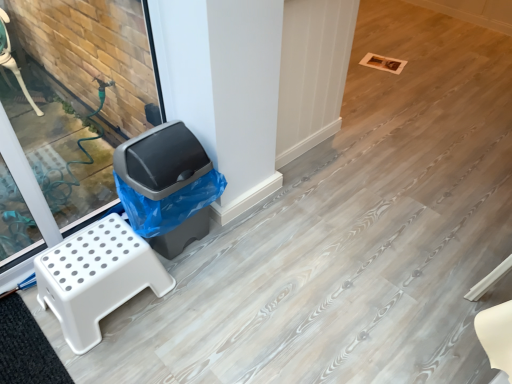
Where is `empty space that is to the right of gray plastic trash can at left`? empty space that is to the right of gray plastic trash can at left is located at coordinates (245, 245).